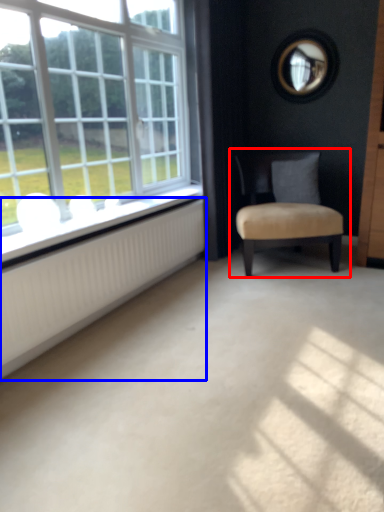
Question: Which point is closer to the camera, chair (highlighted by a red box) or radiator (highlighted by a blue box)?

Choices:
 (A) chair
 (B) radiator

Answer: (B)